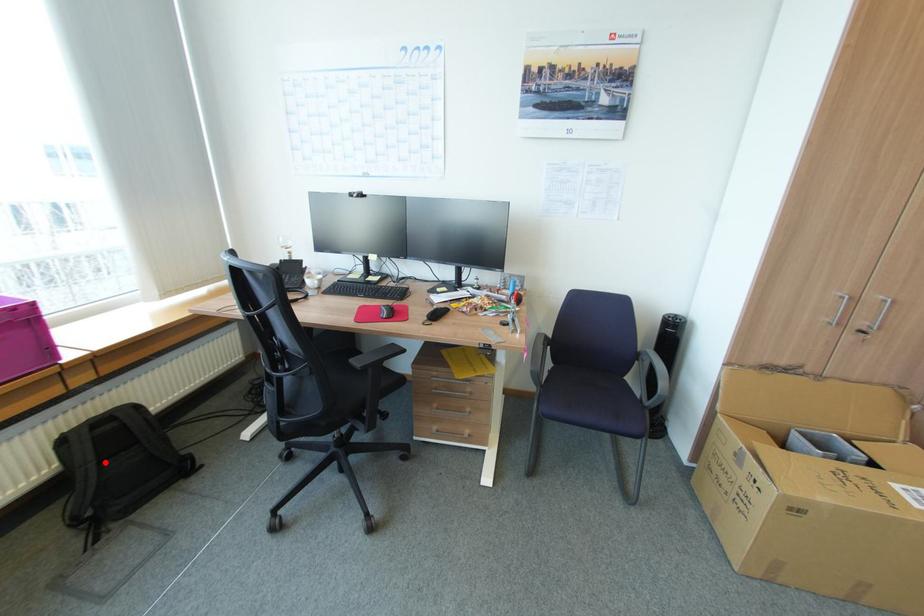
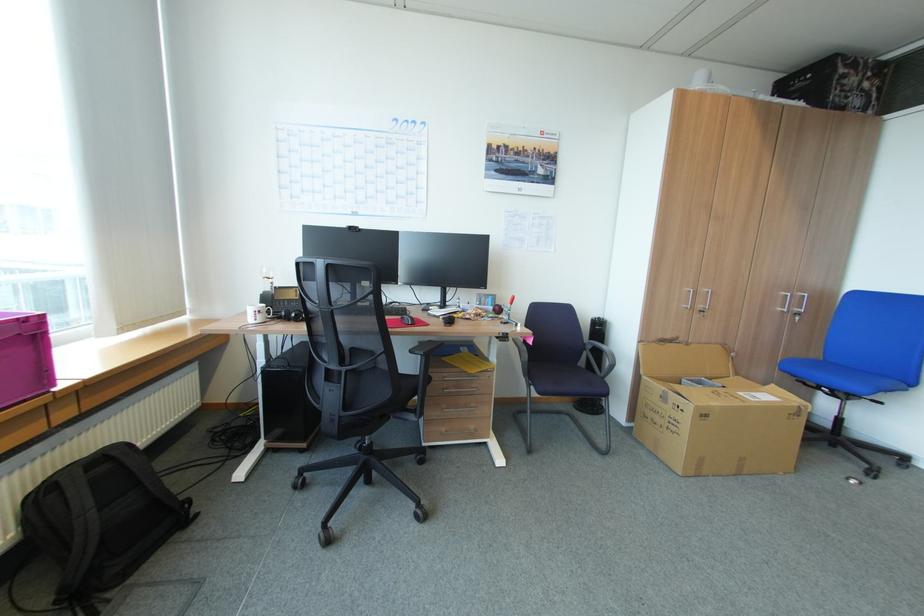
Where in the second image is the point corresponding to the highlighted location from the first image?

(103, 511)